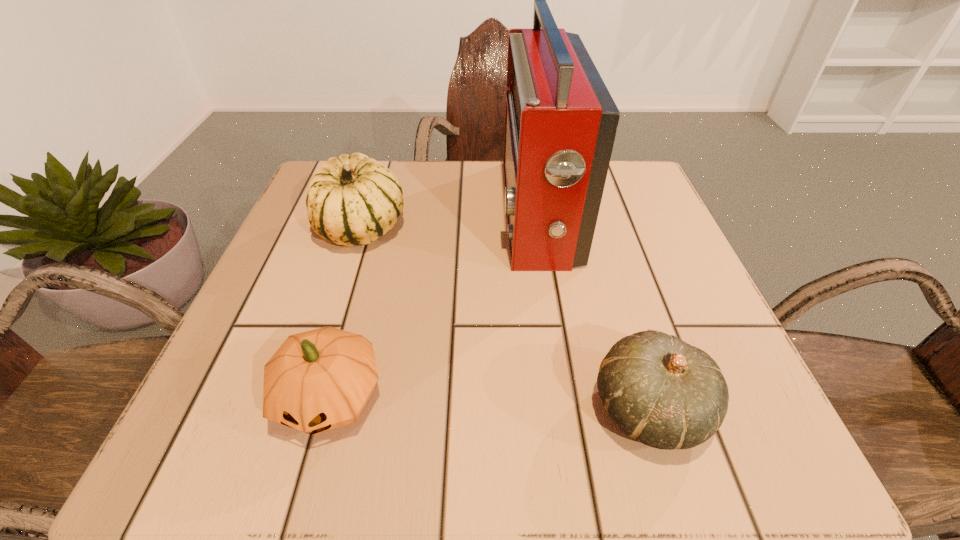
What are the coordinates of `gourd that is at the far edge` in the screenshot? It's located at (353, 199).

At what (x,y) coordinates should I click in order to perform the action: click on object that is at the right edge. Please return your answer as a coordinate pair (x, y). The image size is (960, 540). Looking at the image, I should click on (665, 393).

I want to click on object that is at the far left corner, so click(353, 199).

I want to click on object that is at the near left corner, so click(x=318, y=380).

Where is `object located at the near right corner`? This screenshot has width=960, height=540. object located at the near right corner is located at coordinates (665, 393).

In the image, there is a desktop. At what (x,y) coordinates should I click in order to perform the action: click on free region at the far edge. Please return your answer as a coordinate pair (x, y). Looking at the image, I should click on (479, 202).

I want to click on free space at the near edge, so click(548, 403).

Find the location of a particular element. Image resolution: width=960 pixels, height=540 pixels. vacant region at the left edge of the desktop is located at coordinates (348, 307).

The image size is (960, 540). Identify the location of blank space at the right edge. (650, 240).

Find the location of a particular element. Image resolution: width=960 pixels, height=540 pixels. free space at the near left corner of the desktop is located at coordinates (180, 469).